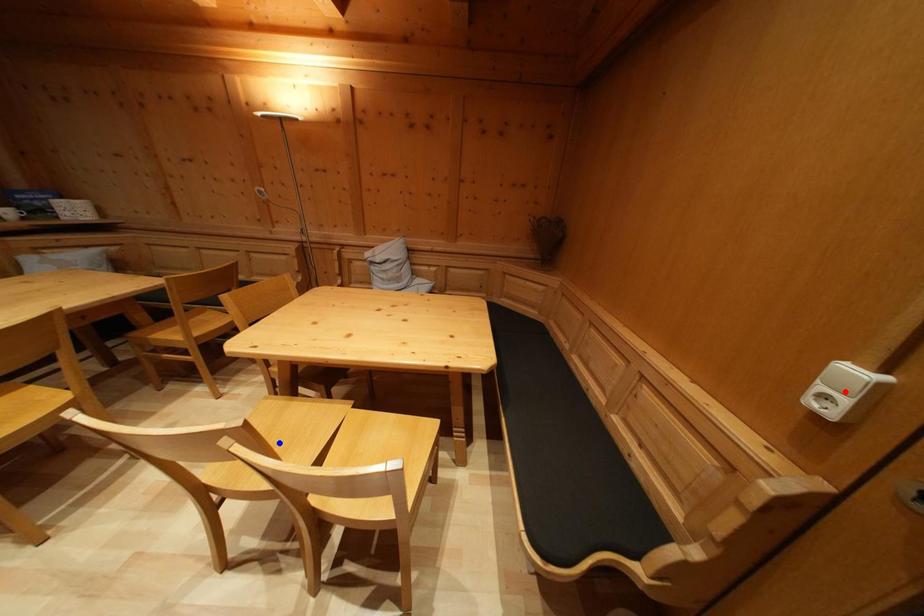
Question: Which of the two points in the image is closer to the camera?

Choices:
 (A) Blue point is closer.
 (B) Red point is closer.

Answer: (B)